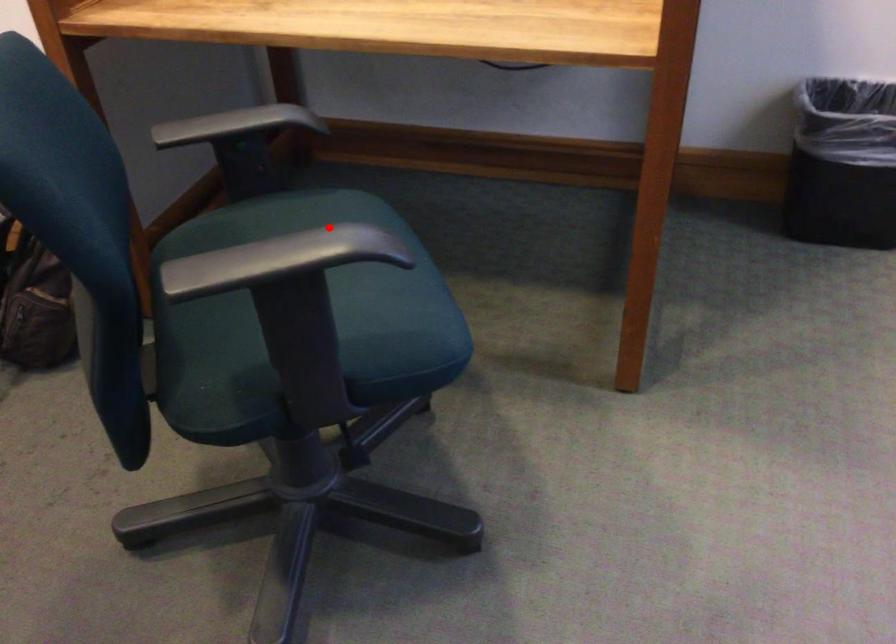
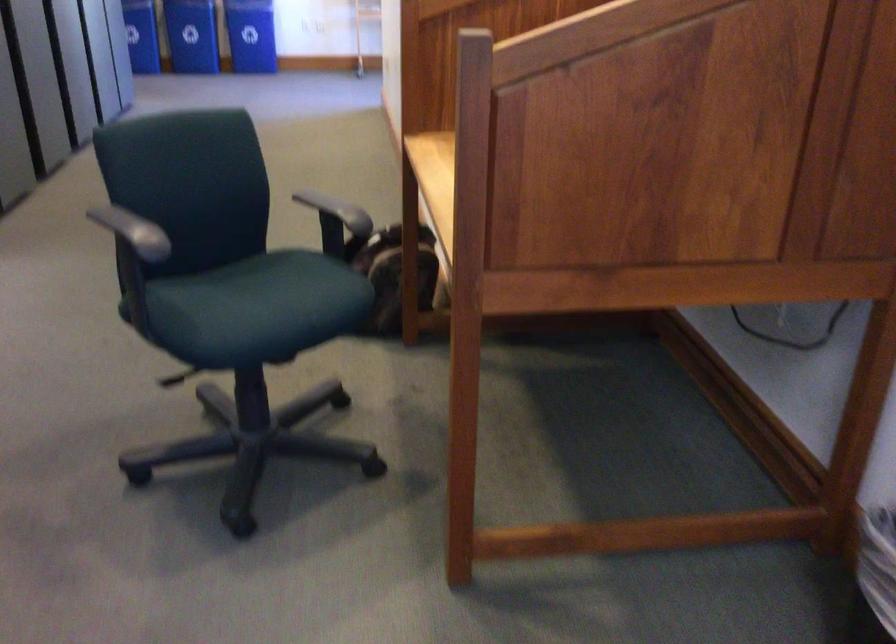
The point at the highlighted location is marked in the first image. Where is the corresponding point in the second image?

(134, 227)